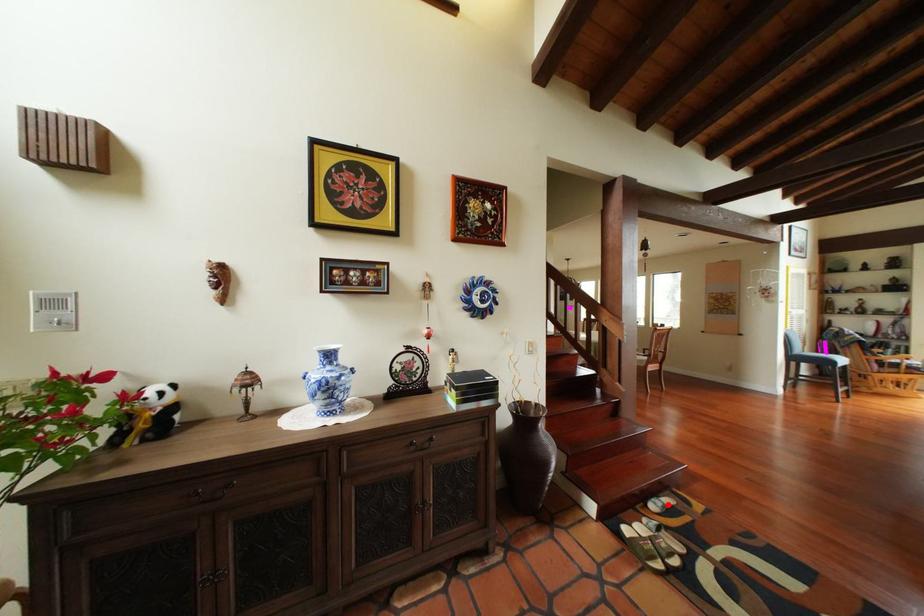
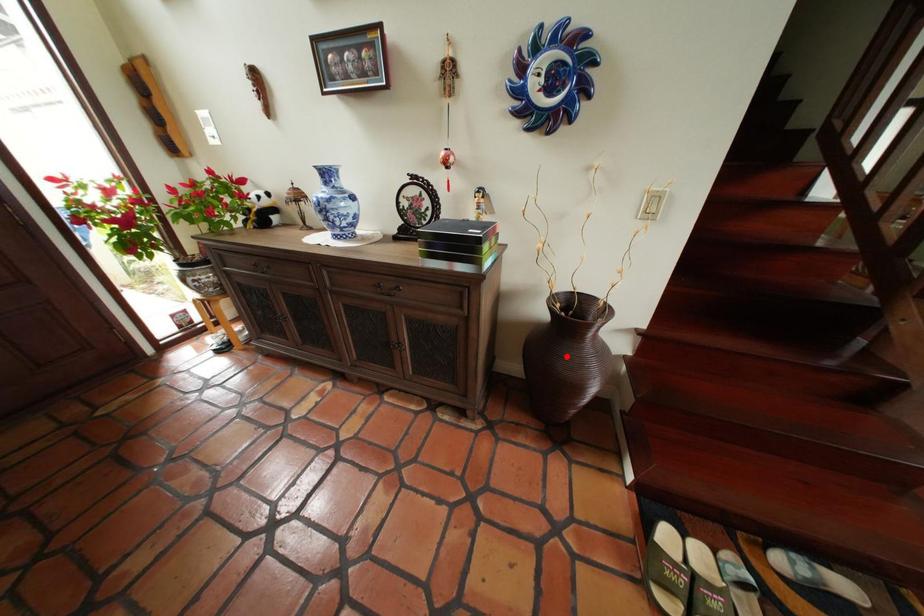
I am providing you with two images of the same scene from different viewpoints. A red point is marked on the first image and another point is marked on the second image. Does the point marked in image1 correspond to the same location as the one in image2?

No